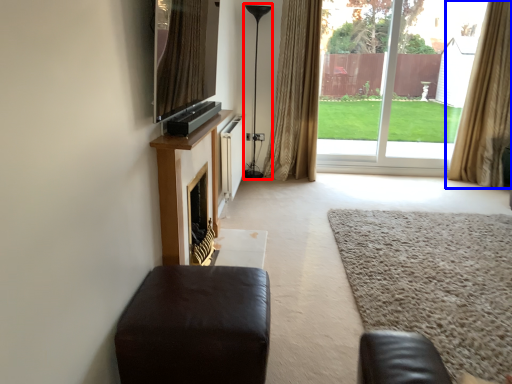
Question: Which of the following is the closest to the observer, lamp (highlighted by a red box) or curtain (highlighted by a blue box)?

Choices:
 (A) lamp
 (B) curtain

Answer: (B)